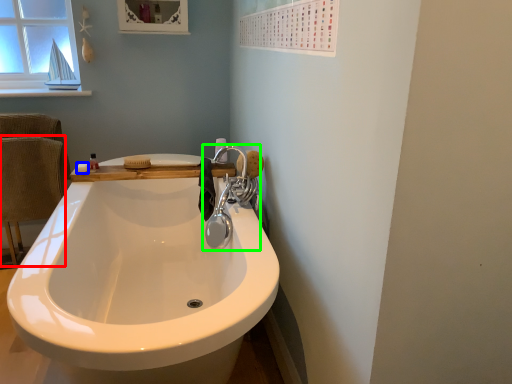
Question: Based on their relative distances, which object is nearer to armchair (highlighted by a red box)? Choose from soap (highlighted by a blue box) and tap (highlighted by a green box).

Choices:
 (A) soap
 (B) tap

Answer: (A)